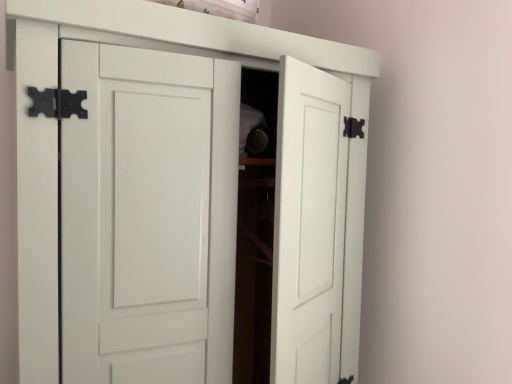
This screenshot has height=384, width=512. Find the location of `white matte cupboard at center`. white matte cupboard at center is located at coordinates (177, 51).

Describe the element at coordinates (177, 51) in the screenshot. I see `white matte cupboard at center` at that location.

What do you see at coordinates (198, 31) in the screenshot?
I see `white matte shelf at upper center` at bounding box center [198, 31].

Locate an element on the screen. The width and height of the screenshot is (512, 384). white matte shelf at upper center is located at coordinates (198, 31).

Locate an element on the screen. Image resolution: width=512 pixels, height=384 pixels. white matte cupboard at center is located at coordinates 177,51.

Between white matte cupboard at center and white matte shelf at upper center, which one appears on the right side from the viewer's perspective?

Positioned to the right is white matte shelf at upper center.

Considering their positions, is white matte cupboard at center located in front of or behind white matte shelf at upper center?

Clearly, white matte cupboard at center is in front of white matte shelf at upper center.

Which point is more forward, (19, 334) or (368, 73)?

Positioned in front is point (19, 334).

From the image's perspective, is white matte cupboard at center under white matte shelf at upper center?

Yes, from the image's perspective, white matte cupboard at center is beneath white matte shelf at upper center.

From a real-world perspective, is white matte cupboard at center physically located above or below white matte shelf at upper center?

From a real-world perspective, white matte cupboard at center is physically below white matte shelf at upper center.

Does white matte cupboard at center have a lesser width compared to white matte shelf at upper center?

No, white matte cupboard at center is not thinner than white matte shelf at upper center.

Who is taller, white matte cupboard at center or white matte shelf at upper center?

white matte cupboard at center is taller.

Which of these two, white matte cupboard at center or white matte shelf at upper center, is smaller?

white matte shelf at upper center is smaller.

Is white matte cupboard at center outside of white matte shelf at upper center?

Yes, white matte cupboard at center is not within white matte shelf at upper center.

Is white matte cupboard at center not near white matte shelf at upper center?

No.

In the scene shown: Is white matte shelf at upper center at the back of white matte cupboard at center?

No, white matte cupboard at center is not facing away from white matte shelf at upper center.

Can you tell me how much white matte cupboard at center and white matte shelf at upper center differ in facing direction?

There is a 0.00145-degree angle between the facing directions of white matte cupboard at center and white matte shelf at upper center.

Find the location of a particular element. The height and width of the screenshot is (384, 512). cupboard lying on the left of white matte shelf at upper center is located at coordinates (177, 51).

Considering the relative positions of white matte shelf at upper center and white matte cupboard at center in the image provided, is white matte shelf at upper center to the left or to the right of white matte cupboard at center?

white matte shelf at upper center is positioned on white matte cupboard at center's right side.

Considering the positions of objects white matte shelf at upper center and white matte cupboard at center in the image provided, who is behind, white matte shelf at upper center or white matte cupboard at center?

white matte shelf at upper center is further from the camera.

Considering the positions of point (67, 6) and point (124, 38), is point (67, 6) closer or farther from the camera than point (124, 38)?

Point (67, 6) is closer to the camera than point (124, 38).

From the image's perspective, which object appears higher, white matte shelf at upper center or white matte cupboard at center?

white matte shelf at upper center, from the image's perspective.

From a real-world perspective, is white matte shelf at upper center physically above white matte cupboard at center?

Indeed, from a real-world perspective, white matte shelf at upper center stands above white matte cupboard at center.

Does white matte shelf at upper center have a greater width compared to white matte cupboard at center?

In fact, white matte shelf at upper center might be narrower than white matte cupboard at center.

From their relative heights in the image, would you say white matte shelf at upper center is taller or shorter than white matte cupboard at center?

Considering their sizes, white matte shelf at upper center has less height than white matte cupboard at center.

Between white matte shelf at upper center and white matte cupboard at center, which one has smaller size?

white matte shelf at upper center.

Would you say white matte shelf at upper center is outside white matte cupboard at center?

That's correct, white matte shelf at upper center is outside of white matte cupboard at center.

Is white matte shelf at upper center next to white matte cupboard at center?

Yes, white matte shelf at upper center is right next to white matte cupboard at center and making contact.

Is white matte shelf at upper center oriented towards white matte cupboard at center?

No.

How different are the orientations of white matte shelf at upper center and white matte cupboard at center in degrees?

There is a 0.00145-degree angle between the facing directions of white matte shelf at upper center and white matte cupboard at center.

How far apart are white matte shelf at upper center and white matte cupboard at center?

A distance of 3.81 inches exists between white matte shelf at upper center and white matte cupboard at center.

Identify the location of shelf above the white matte cupboard at center (from a real-world perspective). The height and width of the screenshot is (384, 512). (198, 31).

The image size is (512, 384). I want to click on shelf on the right side of white matte cupboard at center, so click(198, 31).

This screenshot has width=512, height=384. I want to click on cupboard in front of the white matte shelf at upper center, so click(177, 51).